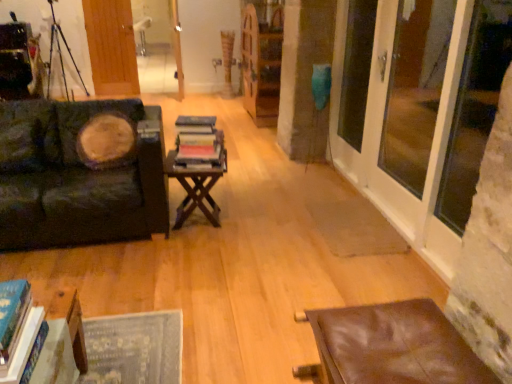
Question: Is brown wooden table at center, the second table when ordered from right to left, not within transparent glass door at right, the 2th window screen positioned from the front?

Choices:
 (A) yes
 (B) no

Answer: (A)

Question: Considering the relative sizes of brown wooden table at center, placed as the third table when sorted from bottom to top, and transparent glass door at right, the 2th window screen positioned from the back, in the image provided, is brown wooden table at center, placed as the third table when sorted from bottom to top, taller than transparent glass door at right, the 2th window screen positioned from the back,?

Choices:
 (A) no
 (B) yes

Answer: (A)

Question: From the image's perspective, would you say brown wooden table at center, the 3th table when ordered from front to back, is positioned over transparent glass door at right, the 2th window screen positioned from the front?

Choices:
 (A) yes
 (B) no

Answer: (B)

Question: Could you tell me if brown wooden table at center, placed as the third table when sorted from bottom to top, is facing transparent glass door at right, the 2th window screen positioned from the back?

Choices:
 (A) yes
 (B) no

Answer: (B)

Question: Are brown wooden table at center, placed as the third table when sorted from bottom to top, and transparent glass door at right, the 2th window screen positioned from the front, far apart?

Choices:
 (A) yes
 (B) no

Answer: (A)

Question: Is transparent glass door at right, the 2th window screen positioned from the back, at the back of brown wooden table at center, arranged as the first table when viewed from the back?

Choices:
 (A) yes
 (B) no

Answer: (B)

Question: From the image's perspective, is transparent glass door at right, the 2th window screen positioned from the back, located beneath velvet dark green couch at left?

Choices:
 (A) yes
 (B) no

Answer: (B)

Question: Does transparent glass door at right, the 2th window screen positioned from the back, have a greater height compared to velvet dark green couch at left?

Choices:
 (A) yes
 (B) no

Answer: (A)

Question: Can you confirm if transparent glass door at right, the 2th window screen positioned from the front, is positioned to the right of velvet dark green couch at left?

Choices:
 (A) yes
 (B) no

Answer: (A)

Question: Considering the relative sizes of transparent glass door at right, the 2th window screen positioned from the front, and velvet dark green couch at left in the image provided, is transparent glass door at right, the 2th window screen positioned from the front, smaller than velvet dark green couch at left?

Choices:
 (A) no
 (B) yes

Answer: (B)

Question: Is transparent glass door at right, the 2th window screen positioned from the back, positioned far away from velvet dark green couch at left?

Choices:
 (A) no
 (B) yes

Answer: (B)

Question: Is velvet dark green couch at left inside transparent glass door at right, the 2th window screen positioned from the front?

Choices:
 (A) no
 (B) yes

Answer: (A)

Question: From a real-world perspective, does transparent glass door at right, which is the first window screen from front to back, stand above transparent glass door at right, the 2th window screen positioned from the front?

Choices:
 (A) no
 (B) yes

Answer: (B)